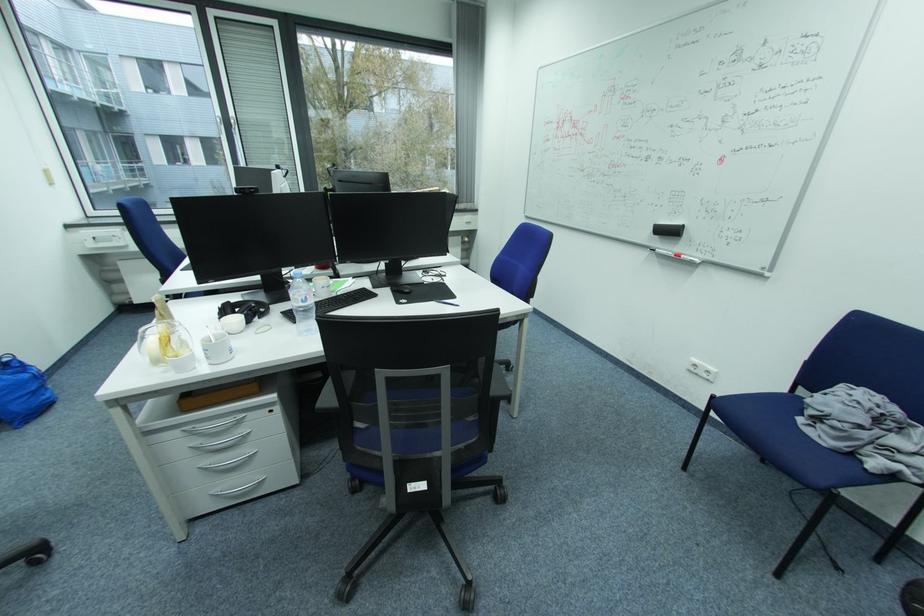
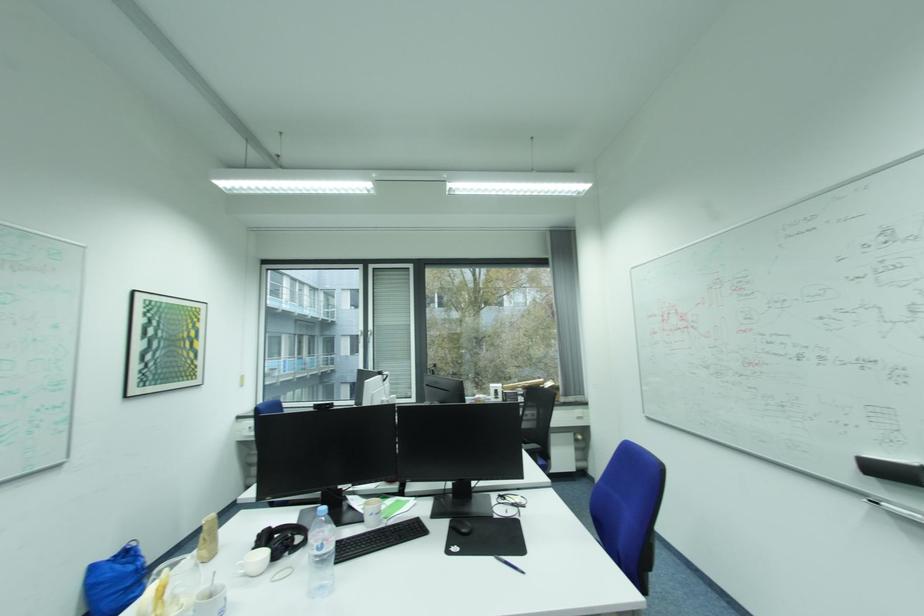
Find the pixel in the second image that matches point 342,307 in the first image.

(378, 548)